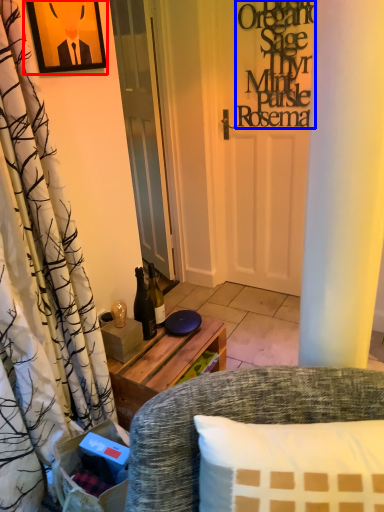
Question: Which of the following is the closest to the observer, picture frame (highlighted by a red box) or writing (highlighted by a blue box)?

Choices:
 (A) picture frame
 (B) writing

Answer: (A)